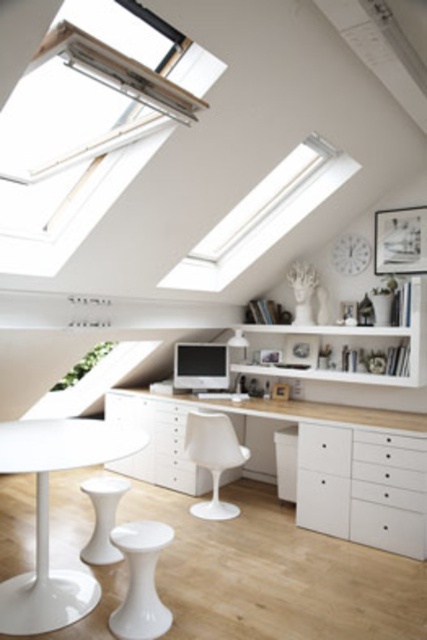
In the scene shown: You are organizing a desk in a modern home office. You have a white glossy table at lower left and a transparent glass window at upper center. Which object is positioned to the left of the other?

The white glossy table at lower left is positioned to the left of the transparent glass window at upper center.

You are organizing cables for a new monitor installation in the home office. You need to ensure that the satin silver monitor at center doesn not block the view of the white plastic window at upper center. Based on their positions, is this possible?

The white plastic window at upper center is to the left of the satin silver monitor at center, so moving the satin silver monitor at center to the right would allow the white plastic window at upper center to remain visible without obstruction.

You are organizing a presentation and need to set up your laptop on the closest object to you in the room. Which object should you choose between the white glossy table at lower left and the transparent glass window at upper center?

The white glossy table at lower left is closer to the viewer than the transparent glass window at upper center, so you should choose the white glossy table at lower left to set up your laptop.